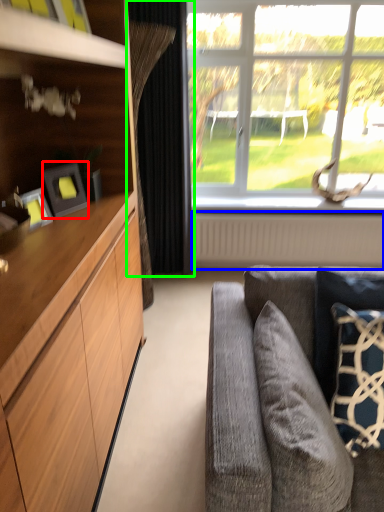
Question: Which object is positioned farthest from picture frame (highlighted by a red box)? Select from radiator (highlighted by a blue box) and curtain (highlighted by a green box).

Choices:
 (A) radiator
 (B) curtain

Answer: (A)